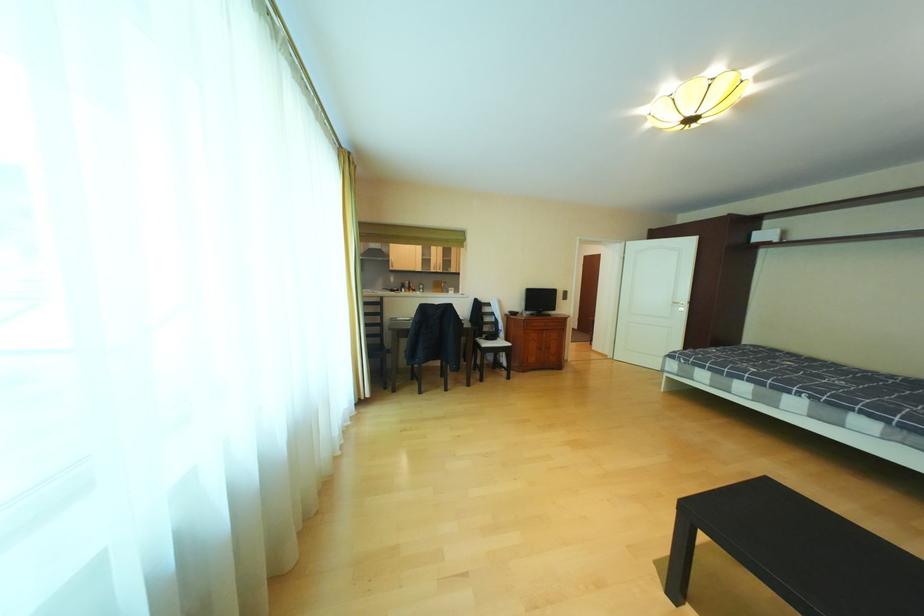
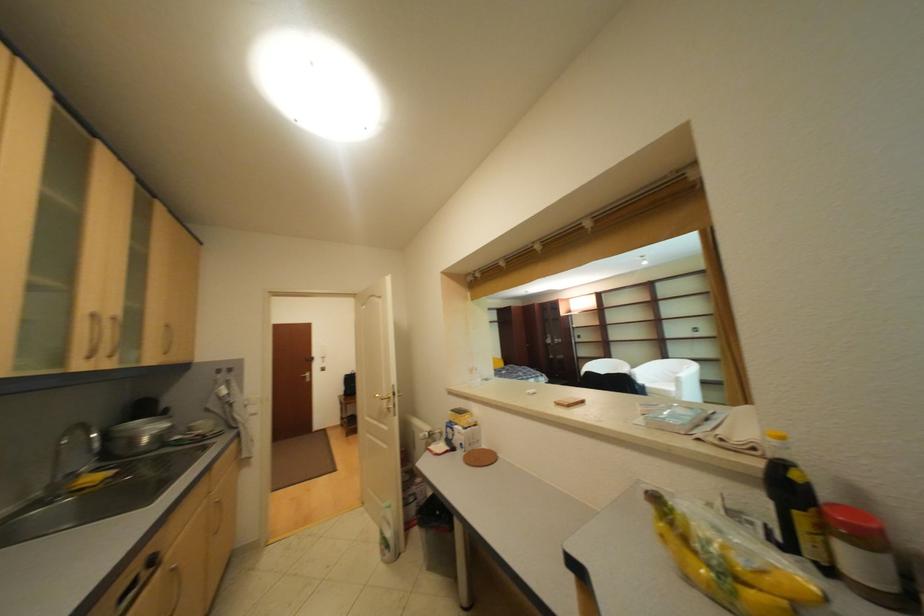
The point at (445, 270) is marked in the first image. Where is the corresponding point in the second image?

(101, 359)